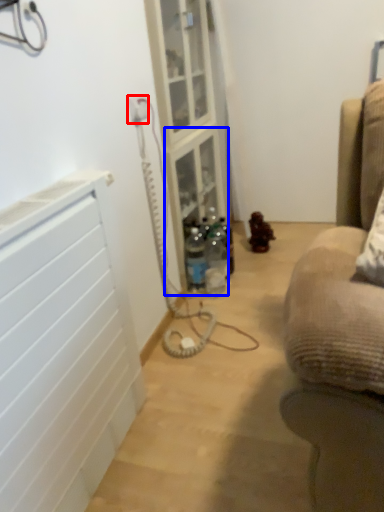
Question: Which point is closer to the camera, electric outlet (highlighted by a red box) or shelf (highlighted by a blue box)?

Choices:
 (A) electric outlet
 (B) shelf

Answer: (A)